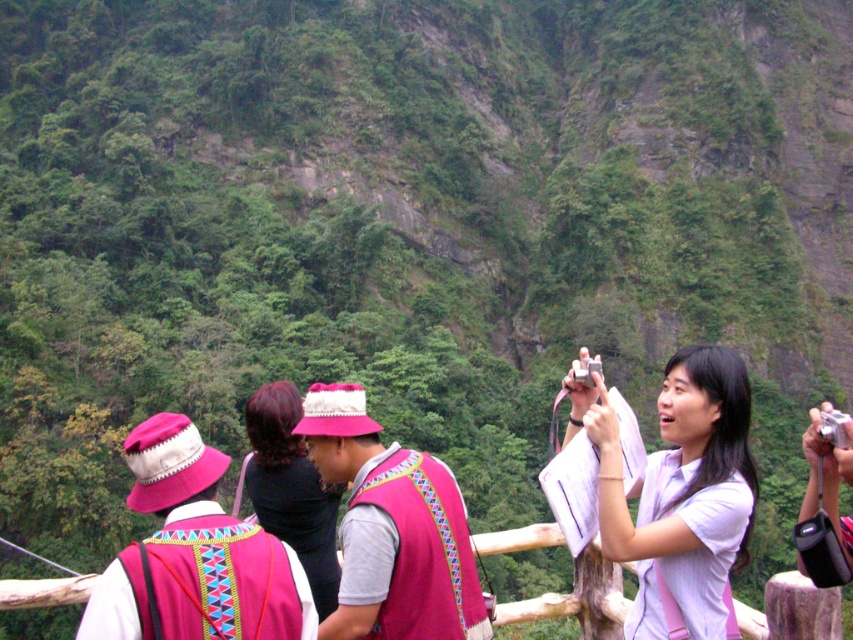
Question: Which of these objects is positioned farthest from the silver metallic camera at upper right?

Choices:
 (A) wooden fence at lower center
 (B) embroidered fabric hat at center

Answer: (A)

Question: Does white matte shirt at center have a greater width compared to embroidered fabric hat at center?

Choices:
 (A) yes
 (B) no

Answer: (B)

Question: Can you confirm if pink fabric hat at center is positioned above wooden fence at lower center?

Choices:
 (A) no
 (B) yes

Answer: (B)

Question: Estimate the real-world distances between objects in this image. Which object is farther from the pink fabric vest at center?

Choices:
 (A) wooden fence at lower center
 (B) white matte shirt at center

Answer: (A)

Question: Estimate the real-world distances between objects in this image. Which object is closer to the white matte shirt at center?

Choices:
 (A) pink fabric hat at center
 (B) silver metallic camera at upper right

Answer: (B)

Question: Can you confirm if embroidered fabric hat at center is positioned above silver metallic camera at upper right?

Choices:
 (A) yes
 (B) no

Answer: (A)